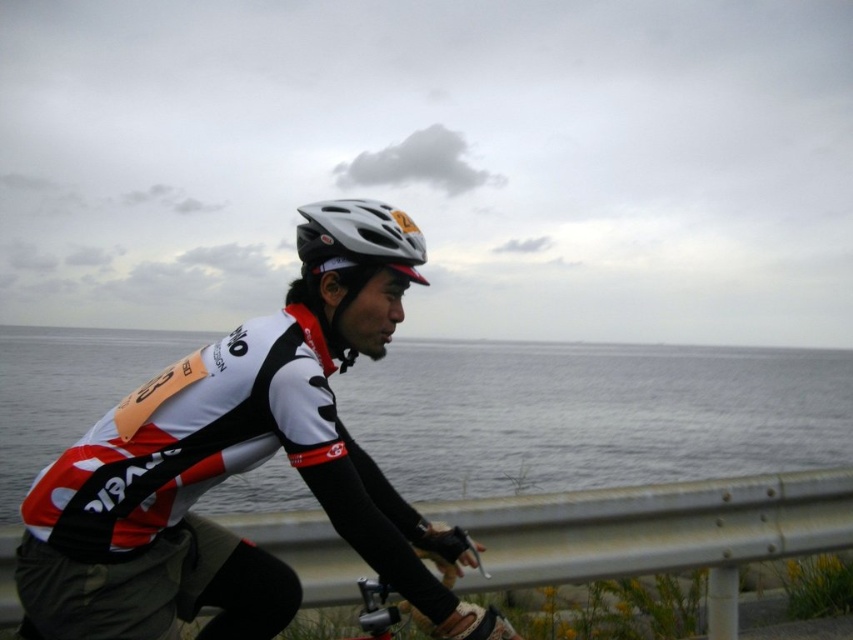
Question: Does matte black helmet at center have a lesser width compared to white matte bicycle helmet at center?

Choices:
 (A) yes
 (B) no

Answer: (B)

Question: Does transparent water at center appear over metallic silver bicycle at lower center?

Choices:
 (A) no
 (B) yes

Answer: (A)

Question: Is white matte bicycle helmet at center smaller than metallic silver bicycle at lower center?

Choices:
 (A) yes
 (B) no

Answer: (A)

Question: Among these objects, which one is nearest to the camera?

Choices:
 (A) white matte bicycle helmet at center
 (B) metallic silver bicycle at lower center
 (C) matte black helmet at center
 (D) transparent water at center

Answer: (C)

Question: Which point is closer to the camera?

Choices:
 (A) (431, 544)
 (B) (21, 376)

Answer: (A)

Question: Which object appears farthest from the camera in this image?

Choices:
 (A) matte black helmet at center
 (B) metallic silver bicycle at lower center
 (C) white matte bicycle helmet at center

Answer: (C)